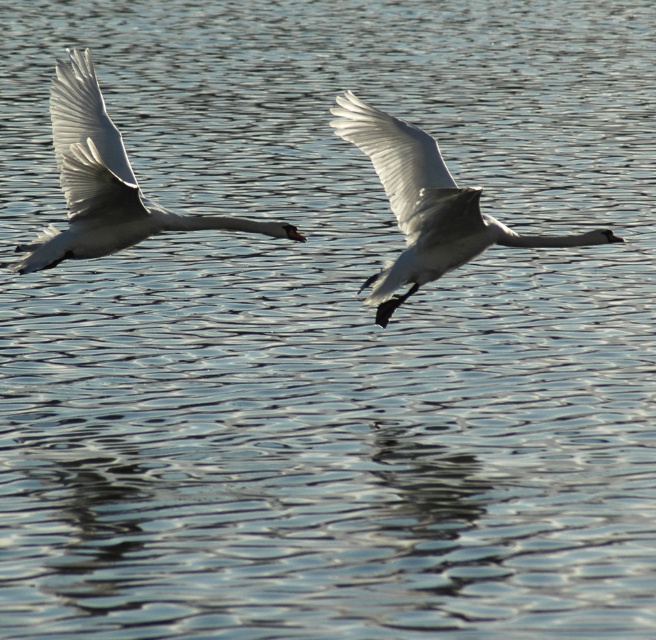
Question: Which point appears farthest from the camera in this image?

Choices:
 (A) (476, 205)
 (B) (110, 144)
 (C) (121, 236)
 (D) (377, 138)

Answer: (B)

Question: Can you confirm if white glossy swan at left is smaller than white glossy wing at left?

Choices:
 (A) yes
 (B) no

Answer: (B)

Question: Among these points, which one is nearest to the camera?

Choices:
 (A) (64, 116)
 (B) (100, 108)

Answer: (B)

Question: Does white glossy swan at left appear on the right side of white glossy wing at left?

Choices:
 (A) yes
 (B) no

Answer: (A)

Question: Which object appears closest to the camera in this image?

Choices:
 (A) white glossy wing at left
 (B) white glossy wing at center
 (C) white glossy swan at center

Answer: (C)

Question: Observing the image, what is the correct spatial positioning of white glossy swan at center in reference to white glossy wing at center?

Choices:
 (A) below
 (B) above

Answer: (A)